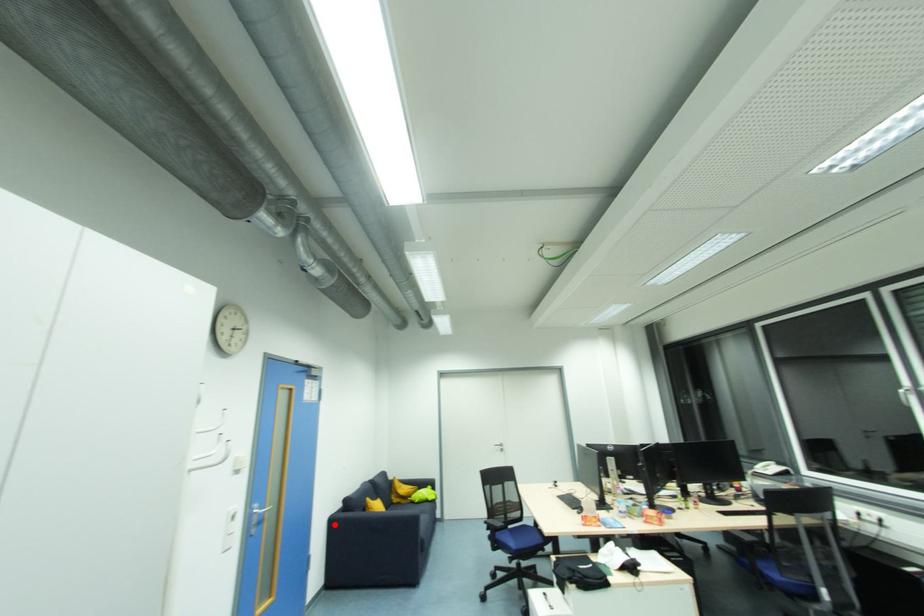
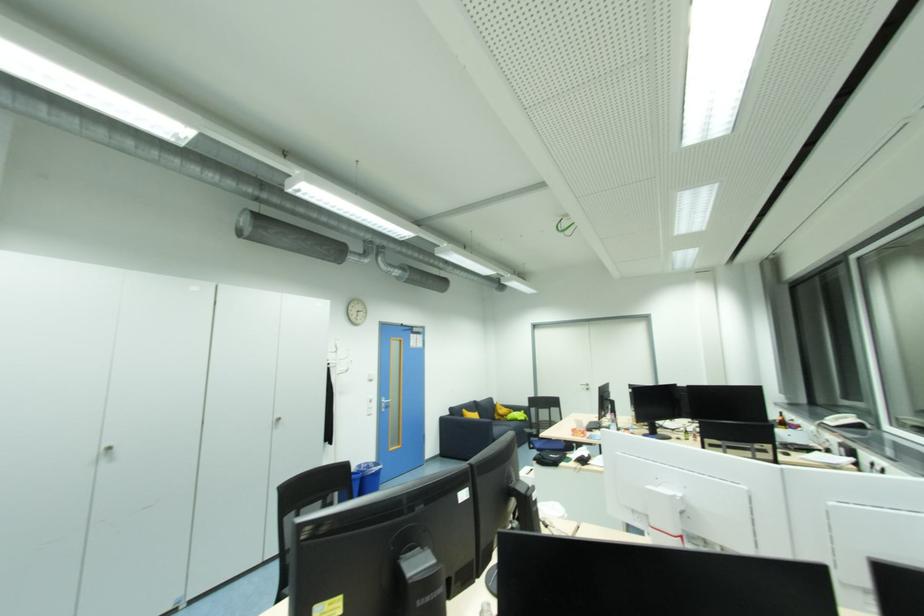
Question: I am providing you with two images of the same scene from different viewpoints. In image1, a red point is highlighted. Considering the same 3D point in image2, which of the following is correct?

Choices:
 (A) It is closer
 (B) It is farther

Answer: (B)